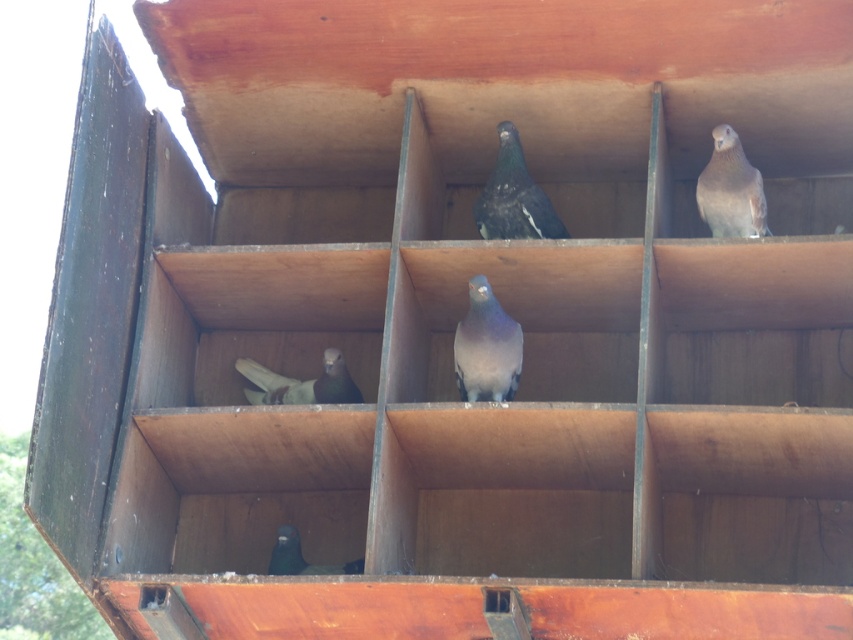
Question: Does gray matte pigeon at center appear on the right side of gray matte pigeon at upper right?

Choices:
 (A) yes
 (B) no

Answer: (B)

Question: Can you confirm if matte gray pigeon at lower left is thinner than shiny black pigeon at lower center?

Choices:
 (A) no
 (B) yes

Answer: (A)

Question: Among these objects, which one is farthest from the camera?

Choices:
 (A) shiny black pigeon at lower center
 (B) gray matte pigeon at upper right
 (C) dark gray matte pigeon at lower center
 (D) shiny dark blue pigeon at center

Answer: (D)

Question: Based on their relative distances, which object is nearer to the gray matte pigeon at center?

Choices:
 (A) gray matte pigeon at upper right
 (B) dark gray matte pigeon at lower center
 (C) shiny dark blue pigeon at center
 (D) matte gray pigeon at lower left

Answer: (C)

Question: Is gray matte pigeon at upper right to the right of matte gray pigeon at lower left from the viewer's perspective?

Choices:
 (A) no
 (B) yes

Answer: (B)

Question: Estimate the real-world distances between objects in this image. Which object is closer to the gray matte pigeon at center?

Choices:
 (A) shiny black pigeon at lower center
 (B) dark gray matte pigeon at lower center
 (C) matte gray pigeon at lower left
 (D) gray matte pigeon at upper right

Answer: (C)